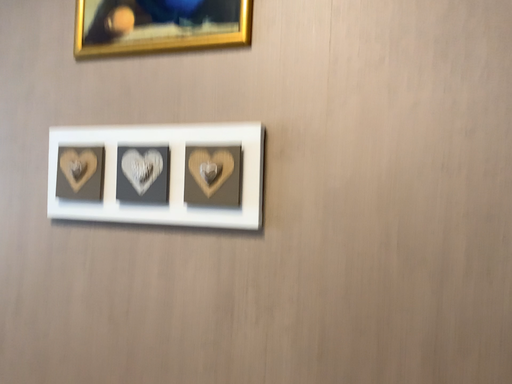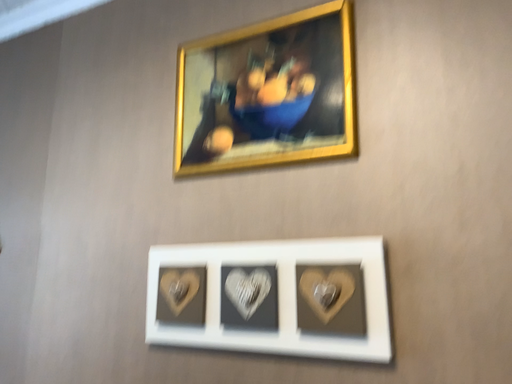
Question: Which way did the camera rotate in the video?

Choices:
 (A) rotated downward
 (B) rotated upward

Answer: (B)